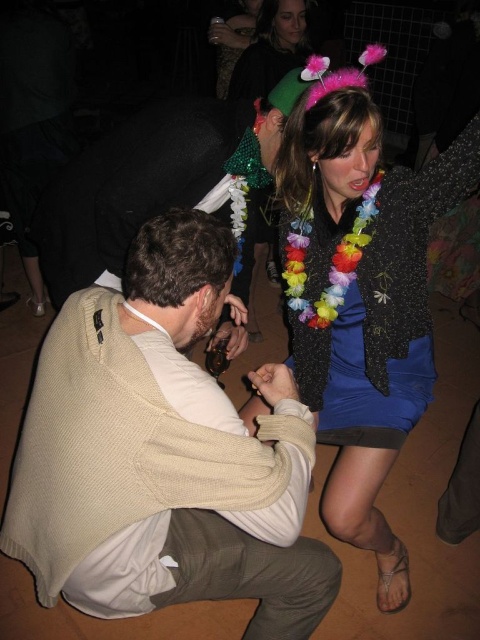
Image resolution: width=480 pixels, height=640 pixels. What are the coordinates of `beige knitted sweater at center` in the screenshot? It's located at (164, 452).

Is beige knitted sweater at center to the right of multicolored flower lei at center from the viewer's perspective?

In fact, beige knitted sweater at center is to the left of multicolored flower lei at center.

Image resolution: width=480 pixels, height=640 pixels. Identify the location of beige knitted sweater at center. (164, 452).

Does sparkly black jacket at upper right have a lesser width compared to multicolored flower lei at center?

Yes, sparkly black jacket at upper right is thinner than multicolored flower lei at center.

Describe the element at coordinates (360, 292) in the screenshot. The height and width of the screenshot is (640, 480). I see `sparkly black jacket at upper right` at that location.

Which is in front, point (287, 196) or point (280, 1)?

Point (287, 196)

Identify the location of sparkly black jacket at upper right. The image size is (480, 640). (360, 292).

Is beige knitted sweater at center taller than beige sweater at lower left?

Correct, beige knitted sweater at center is much taller as beige sweater at lower left.

Is point (160, 525) closer to viewer compared to point (132, 148)?

Yes, it is.

This screenshot has height=640, width=480. I want to click on beige knitted sweater at center, so click(164, 452).